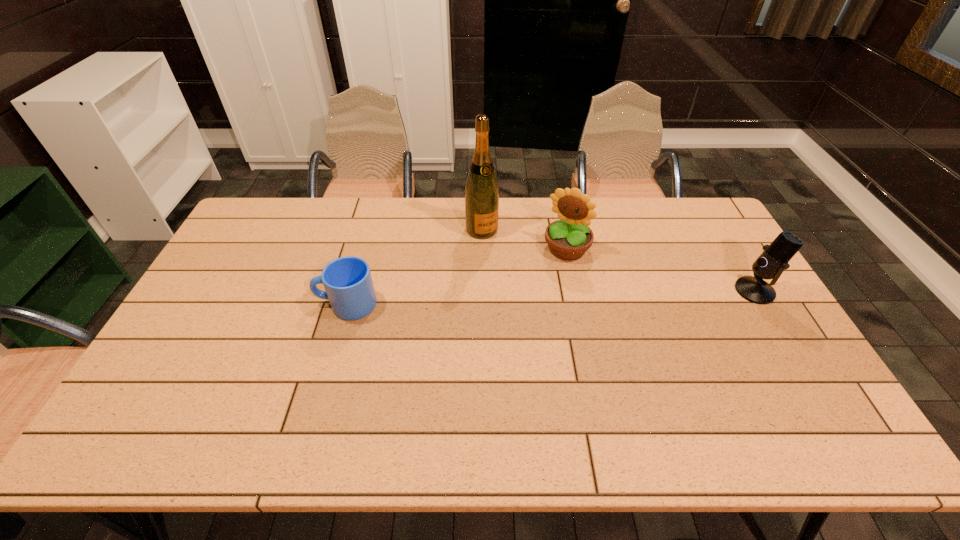
The height and width of the screenshot is (540, 960). I want to click on vacant spot on the desktop that is between the shortest object and the microphone and is positioned on the face of the second object from right to left, so click(x=535, y=298).

In order to click on free space on the desktop that is between the leftmost object and the microphone and is positioned on the front-facing side of the wine bottle in this screenshot , I will do `click(528, 298)`.